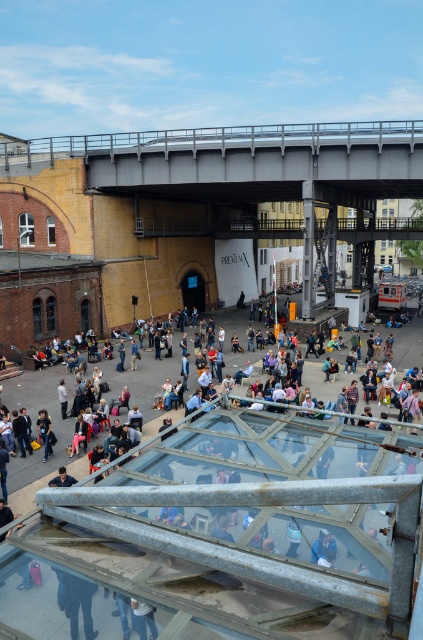
You are a photographer trying to capture a photo of the matte black jacket at center and the gray metallic bridge at upper center in the scene. Which object should you focus on first if you want to include both in your frame without zooming in or out?

A: The matte black jacket at center is smaller than the gray metallic bridge at upper center, so you should focus on the gray metallic bridge at upper center first to ensure it fits in the frame while still capturing the smaller matte black jacket at center.

You are standing at the center of the public square in the image and want to find the matte black jacket at center. According to the coordinates provided, in which direction should you look to locate it?

The matte black jacket at center is located at coordinates point [228,531], which means it is positioned to the right and slightly above your current position at the center. You should look towards the upper right direction to find it.